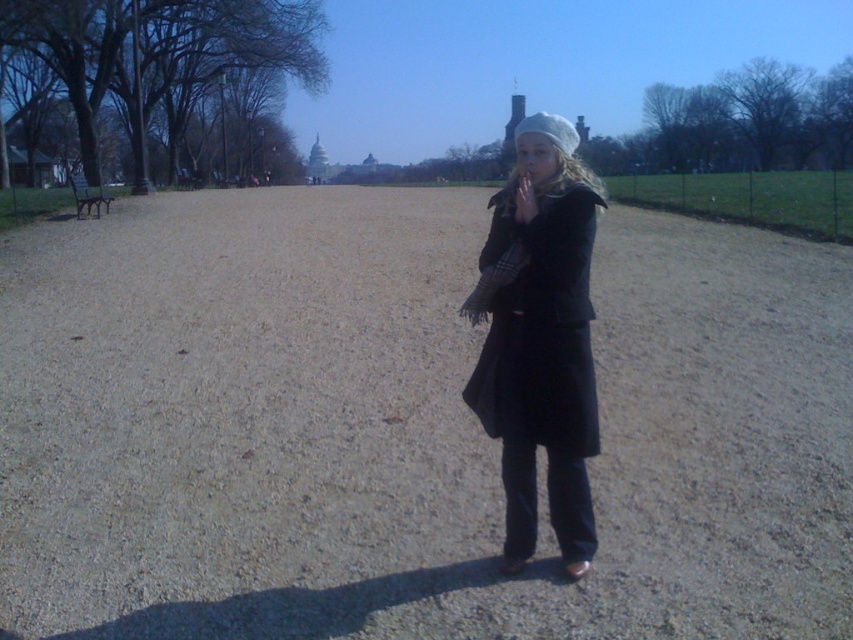
You are a photographer trying to capture a photo of the person in the scene. You notice the matte black coat at center and the matte black hand at center. Which object is located to the right of the other?

The matte black coat at center is positioned on the right side of matte black hand at center.